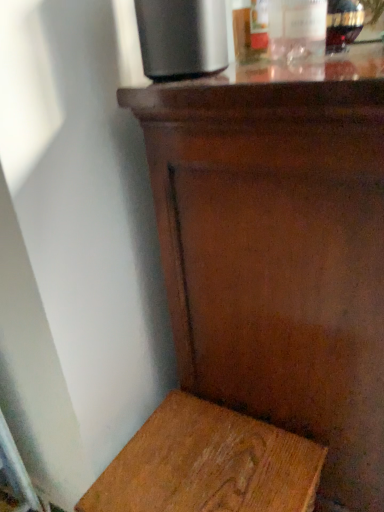
You are a GUI agent. You are given a task and a screenshot of the screen. Output one action in this format:
    pyautogui.click(x=<x>, y=<y>)
    Task: Click on the empty space that is ontop of wooden stool at lower left (from a real-world perspective)
    This screenshot has width=384, height=512.
    Given the screenshot: What is the action you would take?
    pyautogui.click(x=205, y=459)